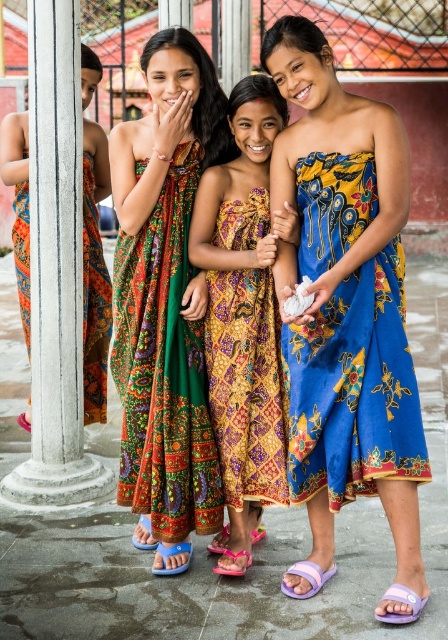
You are standing 10 feet away from the batik dress at center. If you want to take a photo of it using a camera that has a maximum focus distance of 20 feet, will you be able to capture it clearly?

The batik dress at center and camera are 23.95 feet apart from each other. Since you are standing 10 feet away from the batik dress at center, the total distance between you and the camera would be 10 feet plus your distance to the camera. However, the maximum focus distance of the camera is 20 feet. If the camera is positioned such that the total distance from the camera to the batik dress at center is 23.95 feet, then the camera cannot focus on the batik dress at center because it exceeds the maximum 20ft

From the picture: You are a photographer trying to capture the girls in a way that includes both the purple fabric sandal at lower center and the pink fabric sandal at lower center. Which sandal should you focus on first if you want to ensure both are in the frame?

The purple fabric sandal at lower center is positioned on the right side of the pink fabric sandal at lower center. To include both in the frame, focus on the pink fabric sandal at lower center first as it is on the left, allowing you to adjust the camera to capture the purple one on the right without losing either from the shot.

You are a photographer setting up for a group photo of the four girls. You notice two sandals, the purple fabric sandal at lower center and the pink fabric sandal at lower center, near the center of the image. To ensure both sandals are visible in the photo, what is the minimum distance you should keep between the girls and the camera lens?

The purple fabric sandal at lower center is 37.86 inches away from the pink fabric sandal at lower center. To ensure both sandals are visible, the camera should be positioned at least 37.86 inches away from the girls so that the entire distance between the sandals can be captured in the frame.